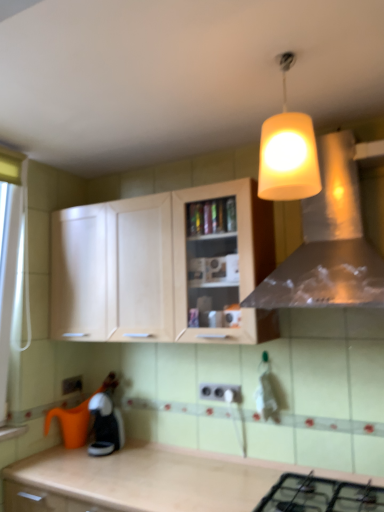
Question: In terms of size, does black matte gas stove at lower center appear bigger or smaller than yellow matte lampshade at upper center?

Choices:
 (A) big
 (B) small

Answer: (B)

Question: Do you think black matte gas stove at lower center is within yellow matte lampshade at upper center, or outside of it?

Choices:
 (A) outside
 (B) inside

Answer: (A)

Question: Which is nearer to the light wood cabinet at center?

Choices:
 (A) black matte gas stove at lower center
 (B) metallic silver vent at upper center
 (C) white plastic electric outlet at center, which appears as the second electric outlet when viewed from the back
 (D) yellow matte lampshade at upper center
 (E) white plastic electric outlet at lower center, which appears as the 2th electric outlet when viewed from the right

Answer: (B)

Question: Considering the real-world distances, which object is farthest from the metallic silver vent at upper center?

Choices:
 (A) white plastic electric outlet at lower center, which is counted as the first electric outlet, starting from the back
 (B) black matte gas stove at lower center
 (C) white plastic electric outlet at center, which is the 2th electric outlet from left to right
 (D) light wood cabinet at center
 (E) yellow matte lampshade at upper center

Answer: (A)